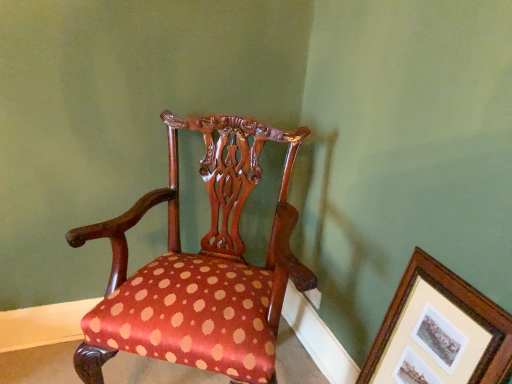
Question: From a real-world perspective, is wooden picture frame at upper right physically below polished wood chair at center?

Choices:
 (A) yes
 (B) no

Answer: (A)

Question: From the image's perspective, is wooden picture frame at upper right located beneath polished wood chair at center?

Choices:
 (A) yes
 (B) no

Answer: (A)

Question: Would you say wooden picture frame at upper right contains polished wood chair at center?

Choices:
 (A) no
 (B) yes

Answer: (A)

Question: Considering the relative positions of wooden picture frame at upper right and polished wood chair at center in the image provided, is wooden picture frame at upper right in front of polished wood chair at center?

Choices:
 (A) no
 (B) yes

Answer: (B)

Question: From a real-world perspective, is wooden picture frame at upper right on polished wood chair at center?

Choices:
 (A) yes
 (B) no

Answer: (B)

Question: Is wooden picture frame at upper right further to camera compared to polished wood chair at center?

Choices:
 (A) yes
 (B) no

Answer: (B)

Question: Are polished wood chair at center and wooden picture frame at upper right located far from each other?

Choices:
 (A) yes
 (B) no

Answer: (B)

Question: Is polished wood chair at center to the right of wooden picture frame at upper right from the viewer's perspective?

Choices:
 (A) yes
 (B) no

Answer: (B)

Question: Considering the relative sizes of polished wood chair at center and wooden picture frame at upper right in the image provided, is polished wood chair at center shorter than wooden picture frame at upper right?

Choices:
 (A) no
 (B) yes

Answer: (A)

Question: Considering the relative sizes of polished wood chair at center and wooden picture frame at upper right in the image provided, is polished wood chair at center smaller than wooden picture frame at upper right?

Choices:
 (A) yes
 (B) no

Answer: (B)

Question: Would you say wooden picture frame at upper right is part of polished wood chair at center's contents?

Choices:
 (A) yes
 (B) no

Answer: (B)

Question: Is polished wood chair at center oriented away from wooden picture frame at upper right?

Choices:
 (A) yes
 (B) no

Answer: (B)

Question: Considering the positions of polished wood chair at center and wooden picture frame at upper right in the image, is polished wood chair at center taller or shorter than wooden picture frame at upper right?

Choices:
 (A) short
 (B) tall

Answer: (B)